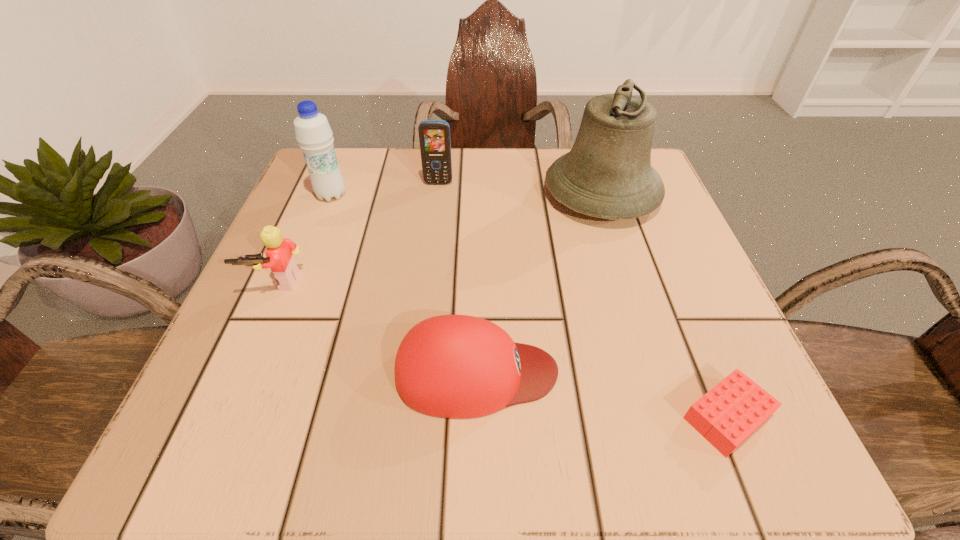
Find the location of `vacant area between the shorter Lego and the bell`. vacant area between the shorter Lego and the bell is located at coordinates (664, 306).

You are a GUI agent. You are given a task and a screenshot of the screen. Output one action in this format:
    pyautogui.click(x=<x>, y=<y>)
    Task: Click on the free area in between the third shortest object and the baseball cap
    
    Given the screenshot: What is the action you would take?
    pyautogui.click(x=377, y=327)

The image size is (960, 540). In order to click on the second closest object relative to the third nearest object in this screenshot , I will do `click(452, 366)`.

Identify which object is located as the third nearest to the farther Lego. Please provide its 2D coordinates. Your answer should be formatted as a tuple, i.e. [(x, y)], where the tuple contains the x and y coordinates of a point satisfying the conditions above.

[(434, 135)]

Where is `free space that satisfies the following two spatial constraints: 1. on the screen of the bell; 2. on the right side of the fourth shortest object`? free space that satisfies the following two spatial constraints: 1. on the screen of the bell; 2. on the right side of the fourth shortest object is located at coordinates (437, 194).